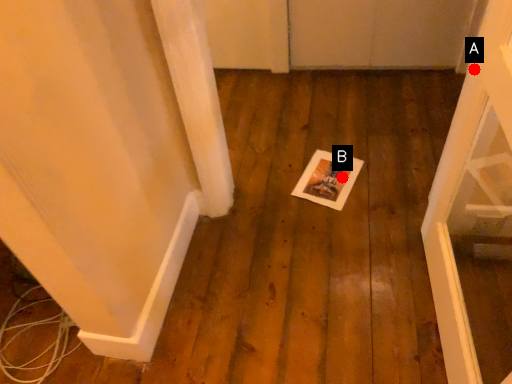
Question: Two points are circled on the image, labeled by A and B beside each circle. Which point is further to the camera?

Choices:
 (A) A is further
 (B) B is further

Answer: (B)